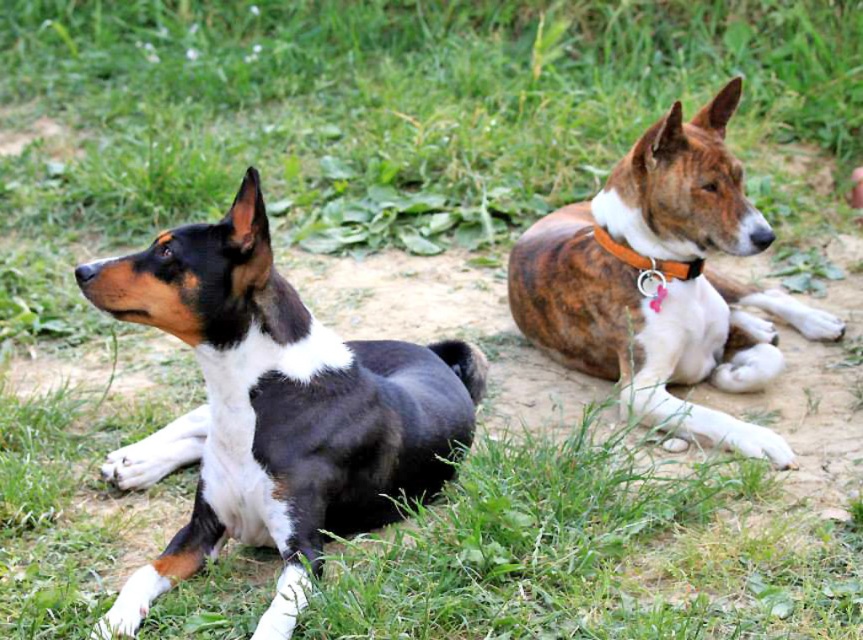
You are standing in a field with two dogs. There is a point marked at coordinates point (224, 355). Can you walk to that point without getting too close to the dogs?

The point (224, 355) is 7.85 feet away from the viewer, so yes, you can walk to that point without getting too close to the dogs since it is a safe distance away.

You are standing at the point with coordinates point (761, 364) and want to walk towards the point with coordinates point (269, 388). Based on the scene, which direction should you move relative to your current position?

You should move forward because point (269, 388) is in front of point (761, 364).